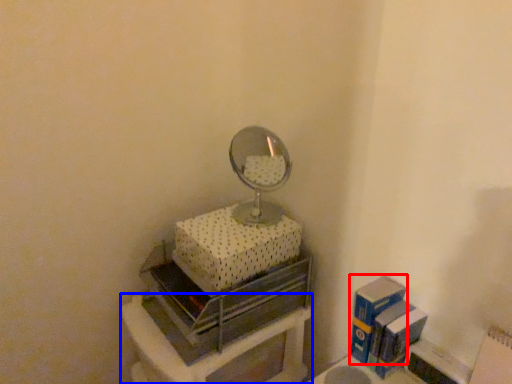
Question: Which object is further to the camera taking this photo, box (highlighted by a red box) or furniture (highlighted by a blue box)?

Choices:
 (A) box
 (B) furniture

Answer: (A)